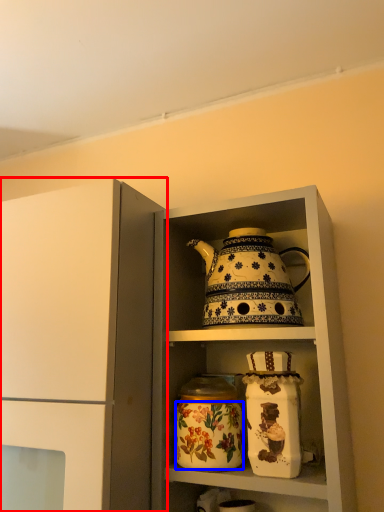
Question: Which object is further to the camera taking this photo, cupboard (highlighted by a red box) or flower (highlighted by a blue box)?

Choices:
 (A) cupboard
 (B) flower

Answer: (B)